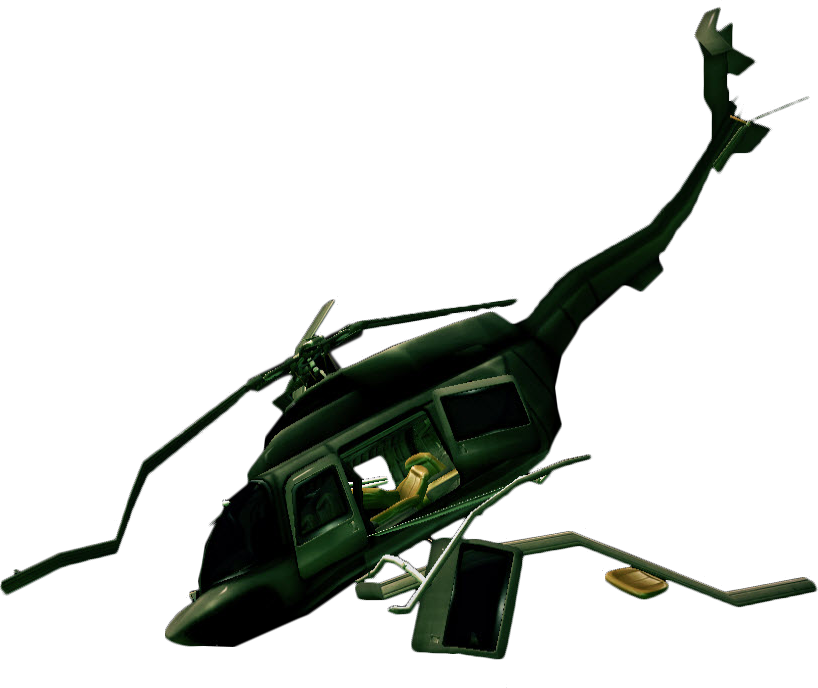
The image size is (818, 688). What are the coordinates of `seat` in the screenshot? It's located at (416, 477).